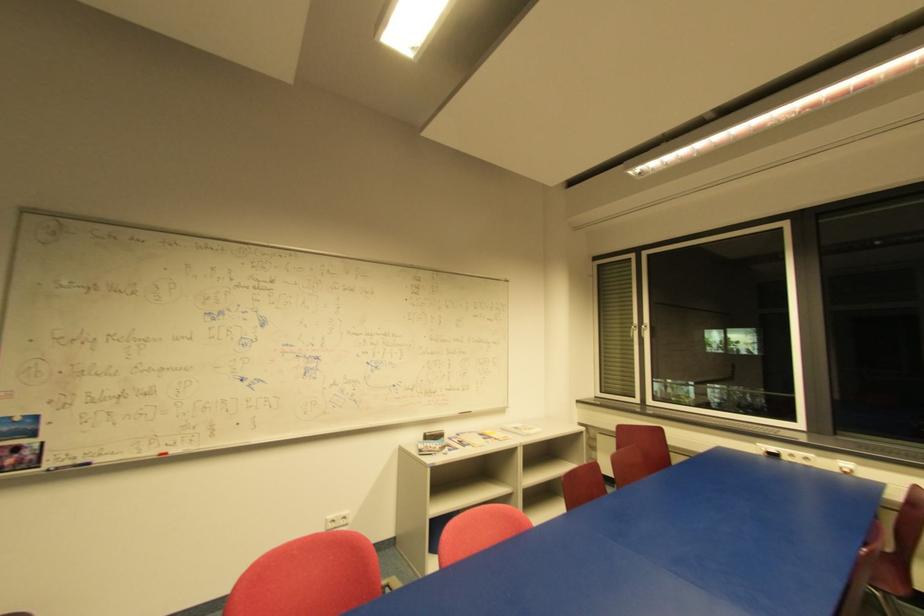
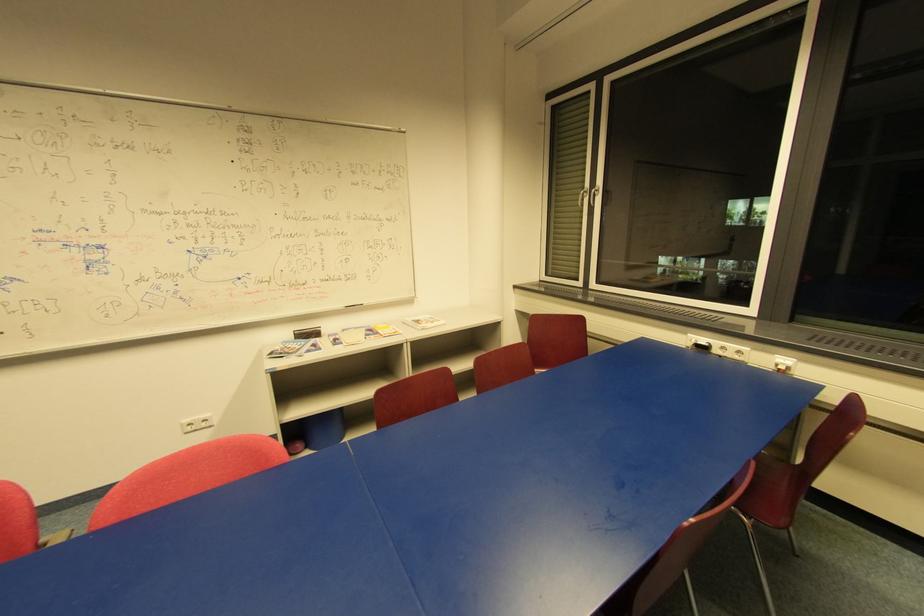
Locate, in the second image, the point that corresponds to [789,459] in the first image.

(720, 352)